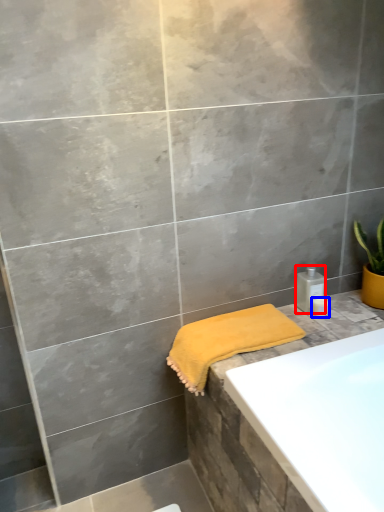
Question: Which object is closer to the camera taking this photo, toiletry (highlighted by a red box) or toiletry (highlighted by a blue box)?

Choices:
 (A) toiletry
 (B) toiletry

Answer: (B)